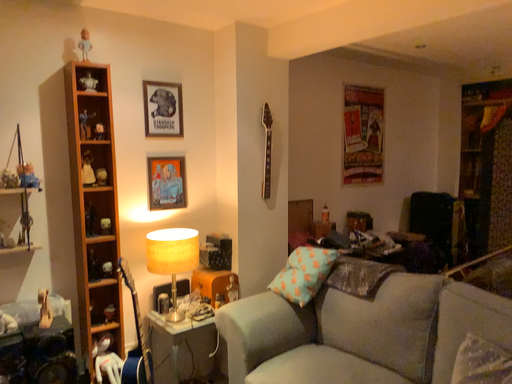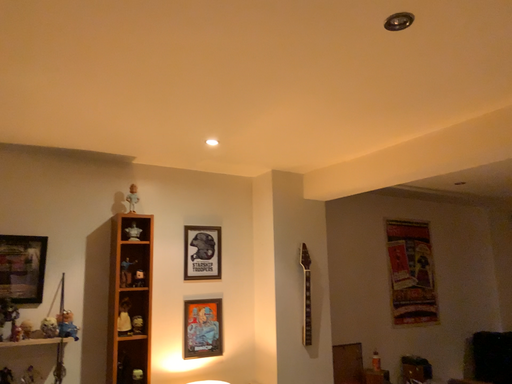
Question: How did the camera likely rotate when shooting the video?

Choices:
 (A) rotated right
 (B) rotated left

Answer: (B)